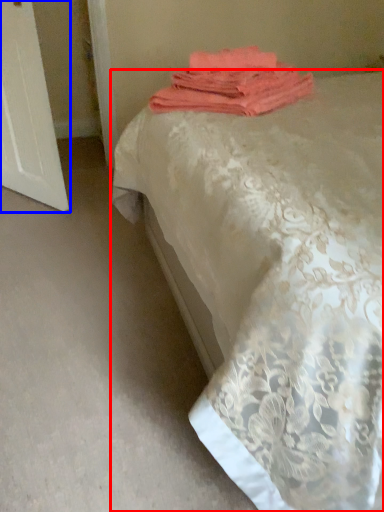
Question: Which object appears farthest to the camera in this image, bed (highlighted by a red box) or screen door (highlighted by a blue box)?

Choices:
 (A) bed
 (B) screen door

Answer: (B)